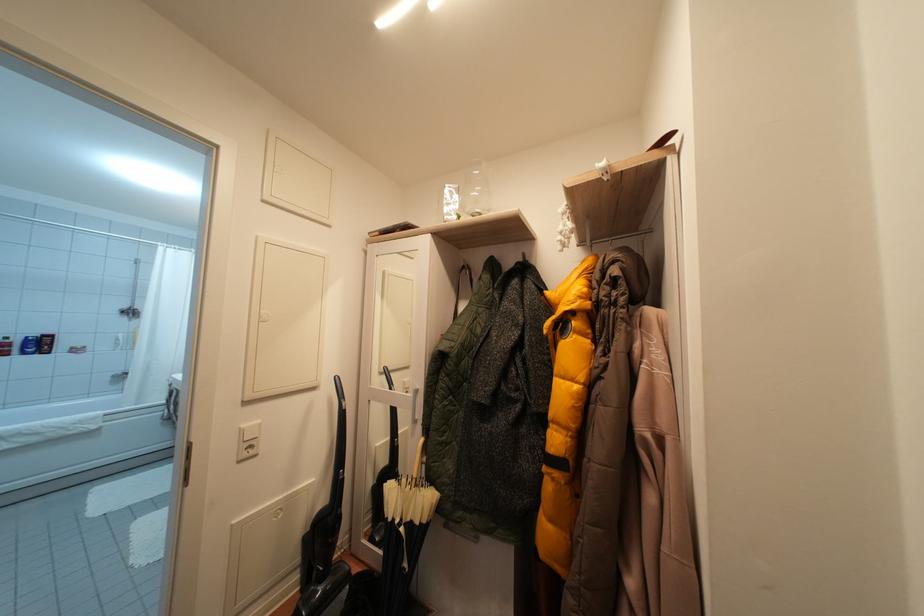
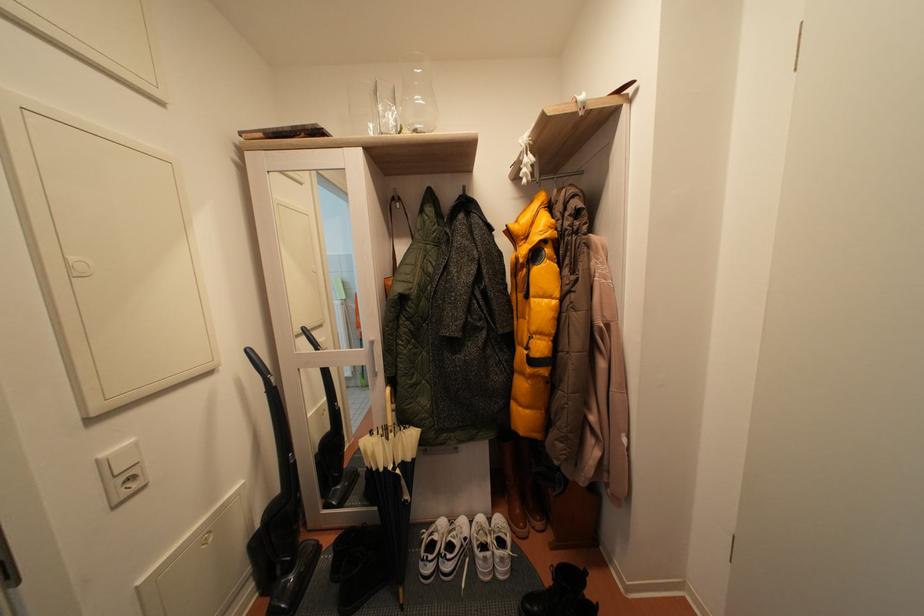
Question: The images are taken continuously from a first-person perspective. In which direction is your viewpoint rotating?

Choices:
 (A) Left
 (B) Right
 (C) Up
 (D) Down

Answer: (B)